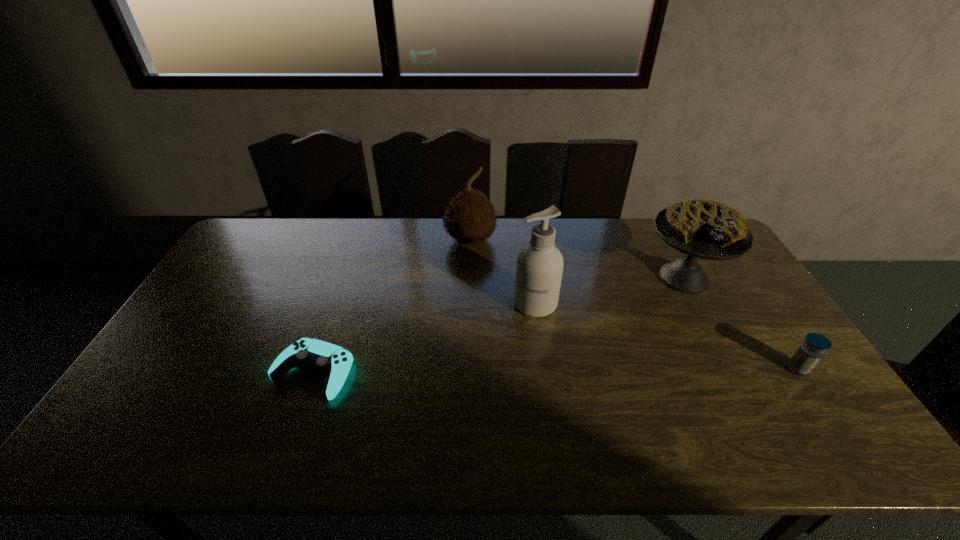
Find the location of a particular element. coconut at the far edge is located at coordinates (469, 218).

Where is `object that is at the near edge`? This screenshot has height=540, width=960. object that is at the near edge is located at coordinates click(333, 362).

At what (x,y) coordinates should I click in order to perform the action: click on medicine located in the right edge section of the desktop. Please return your answer as a coordinate pair (x, y). The image size is (960, 540). Looking at the image, I should click on (810, 352).

Where is `pie that is at the right edge`? The width and height of the screenshot is (960, 540). pie that is at the right edge is located at coordinates (702, 229).

You are a GUI agent. You are given a task and a screenshot of the screen. Output one action in this format:
    pyautogui.click(x=<x>, y=<y>)
    Task: Click on the object that is positioned at the far right corner
    
    Given the screenshot: What is the action you would take?
    pyautogui.click(x=702, y=229)

In order to click on free space at the far edge of the desktop in this screenshot , I will do `click(434, 251)`.

Identify the location of free space at the near edge. The height and width of the screenshot is (540, 960). point(211,415).

The image size is (960, 540). I want to click on vacant space at the left edge of the desktop, so click(264, 260).

The height and width of the screenshot is (540, 960). I want to click on free space at the right edge of the desktop, so [x=733, y=273].

Identify the location of vacant space at the far left corner of the desktop. (267, 221).